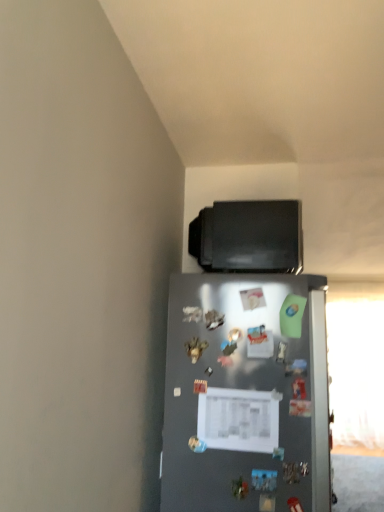
Question: Is black matte tv at upper center taller or shorter than satin silver refrigerator at center?

Choices:
 (A) tall
 (B) short

Answer: (B)

Question: In the image, is black matte tv at upper center positioned in front of or behind satin silver refrigerator at center?

Choices:
 (A) behind
 (B) front

Answer: (A)

Question: Is point (223, 266) positioned closer to the camera than point (205, 462)?

Choices:
 (A) closer
 (B) farther

Answer: (B)

Question: In the image, is satin silver refrigerator at center on the left side or the right side of black matte tv at upper center?

Choices:
 (A) right
 (B) left

Answer: (B)

Question: In terms of size, does satin silver refrigerator at center appear bigger or smaller than black matte tv at upper center?

Choices:
 (A) small
 (B) big

Answer: (B)

Question: From their relative heights in the image, would you say satin silver refrigerator at center is taller or shorter than black matte tv at upper center?

Choices:
 (A) short
 (B) tall

Answer: (B)

Question: From the image's perspective, is satin silver refrigerator at center above or below black matte tv at upper center?

Choices:
 (A) above
 (B) below

Answer: (B)